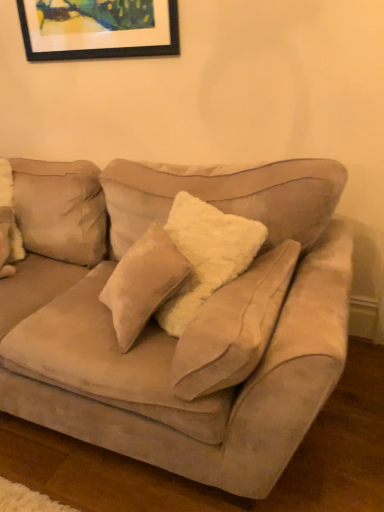
Question: Is point (137, 49) positioned closer to the camera than point (241, 428)?

Choices:
 (A) closer
 (B) farther

Answer: (B)

Question: Considering their positions, is matte black picture frame at upper center located in front of or behind suede couch at center?

Choices:
 (A) front
 (B) behind

Answer: (B)

Question: In the image, is matte black picture frame at upper center on the left side or the right side of suede couch at center?

Choices:
 (A) left
 (B) right

Answer: (B)

Question: In terms of height, does suede couch at center look taller or shorter compared to matte black picture frame at upper center?

Choices:
 (A) short
 (B) tall

Answer: (B)

Question: From the image's perspective, is suede couch at center above or below matte black picture frame at upper center?

Choices:
 (A) below
 (B) above

Answer: (A)

Question: In terms of width, does suede couch at center look wider or thinner when compared to matte black picture frame at upper center?

Choices:
 (A) wide
 (B) thin

Answer: (A)

Question: Is suede couch at center spatially inside matte black picture frame at upper center, or outside of it?

Choices:
 (A) outside
 (B) inside

Answer: (A)